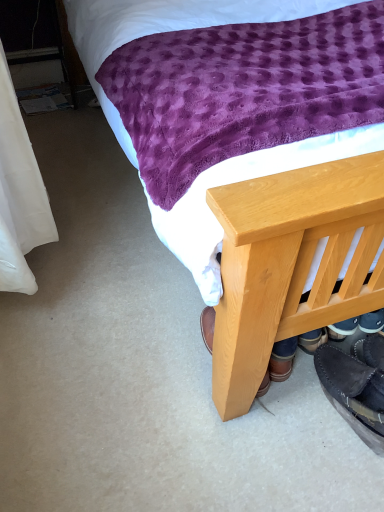
Identify the location of free spot above black suede moccasin at lower right, which is the 1th footwear in left-to-right order (from a real-world perspective). (366, 390).